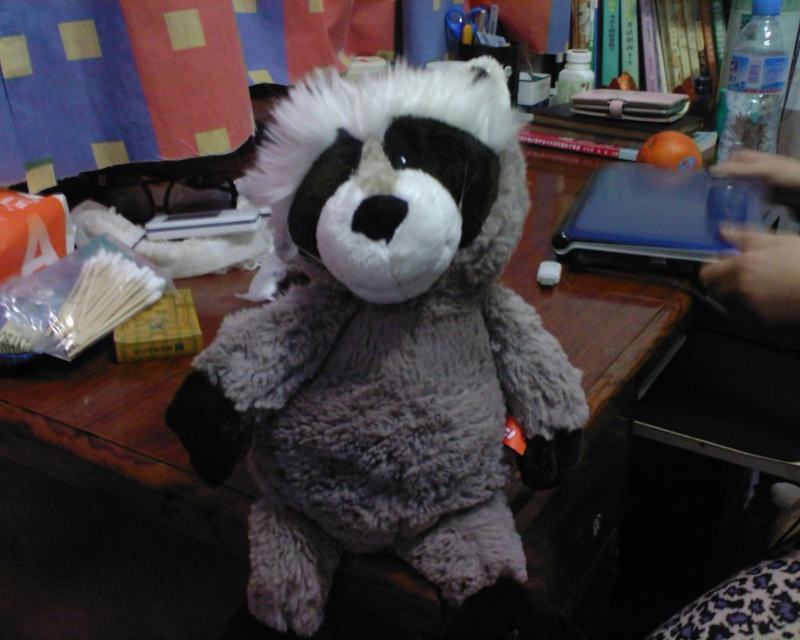
Looking at this image, can you confirm if fluffy gray teddy bear at center is taller than slate gray plastic laptop at upper right?

Indeed, fluffy gray teddy bear at center has a greater height compared to slate gray plastic laptop at upper right.

Is the position of fluffy gray teddy bear at center less distant than that of slate gray plastic laptop at upper right?

Yes, it is.

Where is `fluffy gray teddy bear at center`? The image size is (800, 640). fluffy gray teddy bear at center is located at coordinates (384, 342).